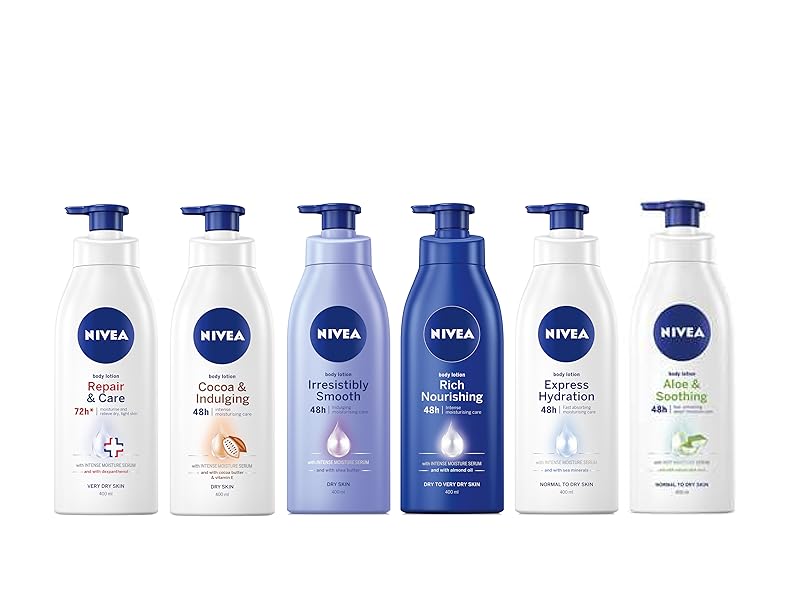
This screenshot has width=800, height=600. Identify the location of lotion pump. (108, 215), (214, 217), (338, 215), (452, 213), (564, 212), (676, 217).